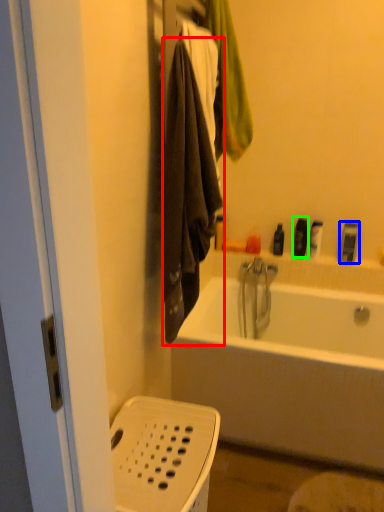
Question: Based on their relative distances, which object is farther from towel/napkin (highlighted by a red box)? Choose from toiletry (highlighted by a blue box) and toiletry (highlighted by a green box).

Choices:
 (A) toiletry
 (B) toiletry

Answer: (A)